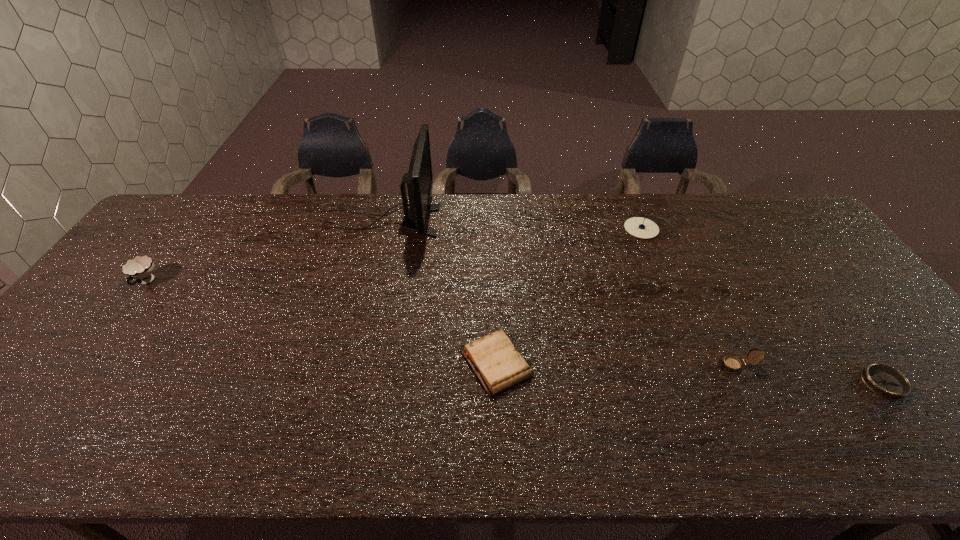
Locate an element on the screen. This screenshot has height=540, width=960. computer monitor is located at coordinates (419, 178).

This screenshot has height=540, width=960. I want to click on the tallest object, so click(x=419, y=178).

The height and width of the screenshot is (540, 960). What are the coordinates of `the leftmost object` in the screenshot? It's located at (140, 268).

The image size is (960, 540). I want to click on the fourth nearest object, so click(140, 268).

The image size is (960, 540). Identify the location of the farthest compass. (639, 227).

At what (x,y) coordinates should I click in order to perform the action: click on the fourth object from right to left. Please return your answer as a coordinate pair (x, y). The width and height of the screenshot is (960, 540). Looking at the image, I should click on (494, 360).

This screenshot has height=540, width=960. Find the location of `diary`. diary is located at coordinates (494, 360).

This screenshot has width=960, height=540. I want to click on the rightmost object, so click(x=887, y=382).

Locate an element on the screen. Image resolution: width=960 pixels, height=540 pixels. the rightmost compass is located at coordinates pos(887,382).

Where is `free space located 0.130m on the screen side of the fifth object from right to left`? free space located 0.130m on the screen side of the fifth object from right to left is located at coordinates (477, 221).